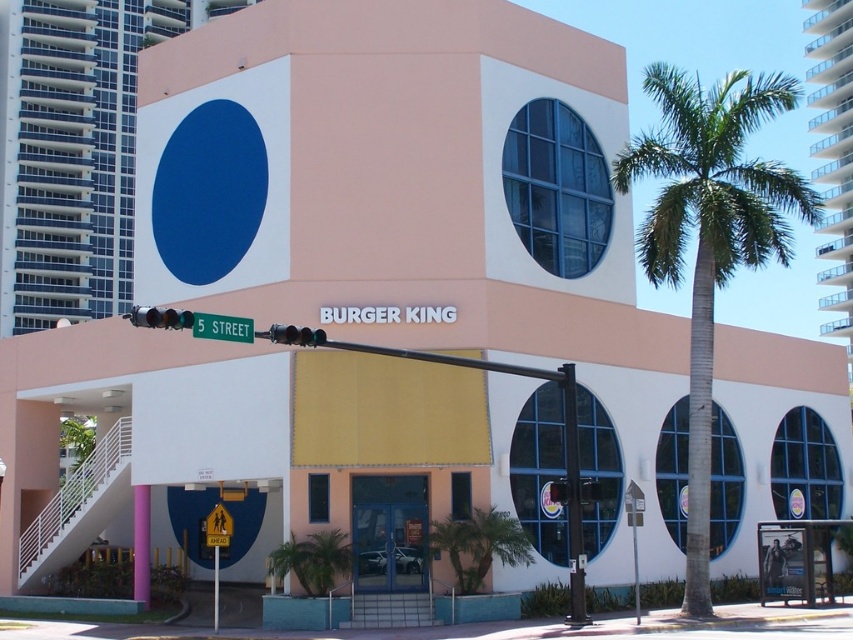
Question: Which object is the closest to the green leafy palm tree at right?

Choices:
 (A) metallic traffic light at center
 (B) metallic traffic light at left

Answer: (A)

Question: Among these points, which one is nearest to the camera?

Choices:
 (A) (550, 493)
 (B) (181, 323)
 (C) (756, 244)
 (D) (277, 336)

Answer: (B)

Question: Can you confirm if black glass traffic light at center is thinner than metallic traffic light at center?

Choices:
 (A) no
 (B) yes

Answer: (B)

Question: Considering the relative positions of green leafy palm tree at right and metallic traffic light at left in the image provided, where is green leafy palm tree at right located with respect to metallic traffic light at left?

Choices:
 (A) right
 (B) left

Answer: (A)

Question: Does green leafy palm tree at right have a smaller size compared to metallic traffic light at center?

Choices:
 (A) no
 (B) yes

Answer: (A)

Question: Which of the following is the closest to the observer?

Choices:
 (A) metallic traffic light at center
 (B) metallic traffic light at left

Answer: (B)